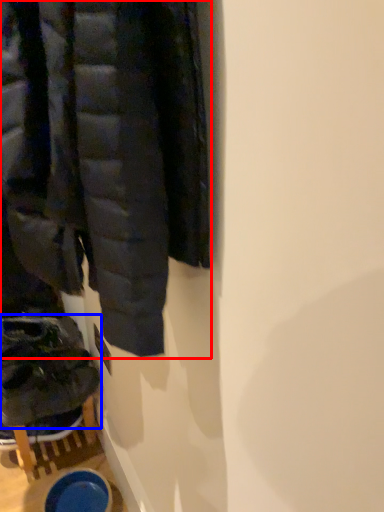
Question: Which of the following is the closest to the observer, jacket (highlighted by a red box) or footwear (highlighted by a blue box)?

Choices:
 (A) jacket
 (B) footwear

Answer: (A)